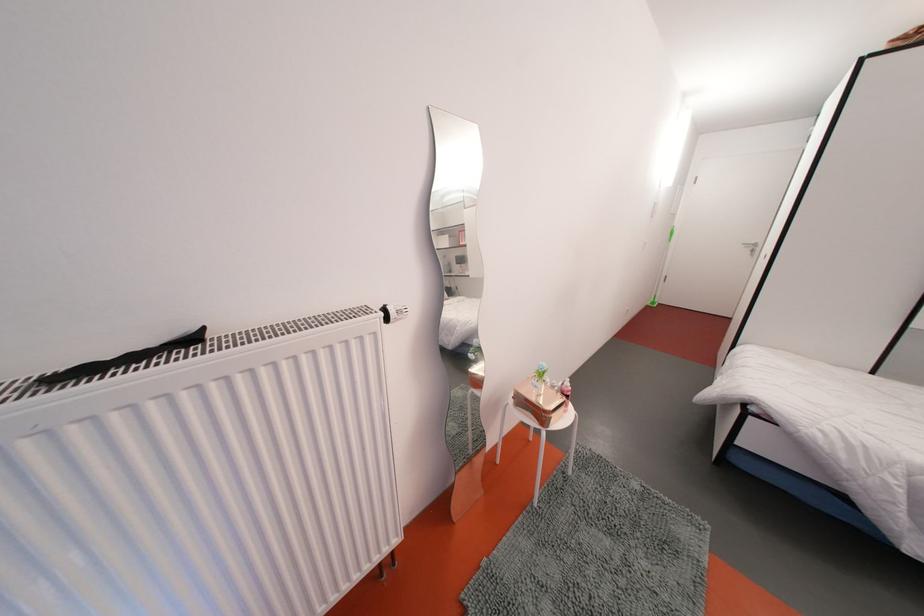
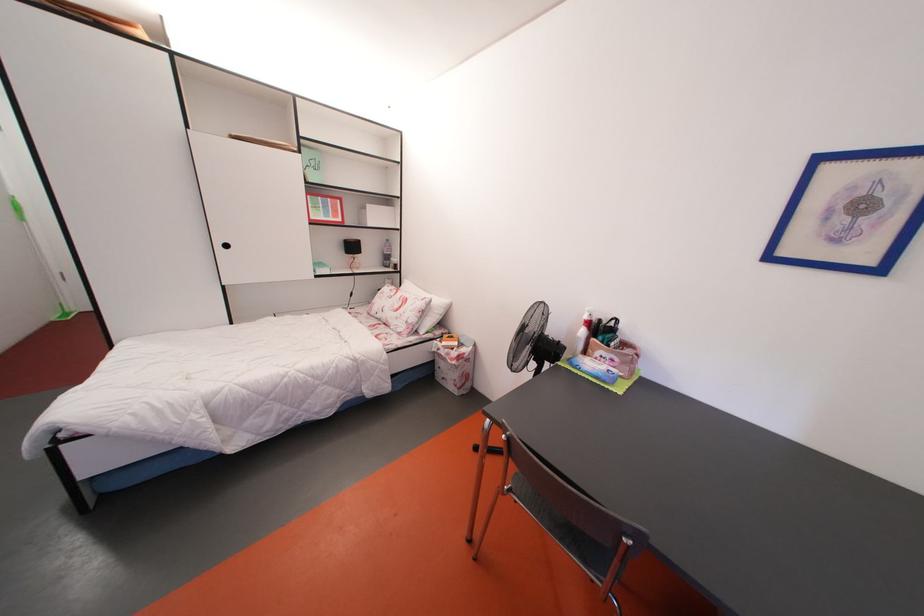
How did the camera likely rotate?

The rotation direction of the camera is right-down.